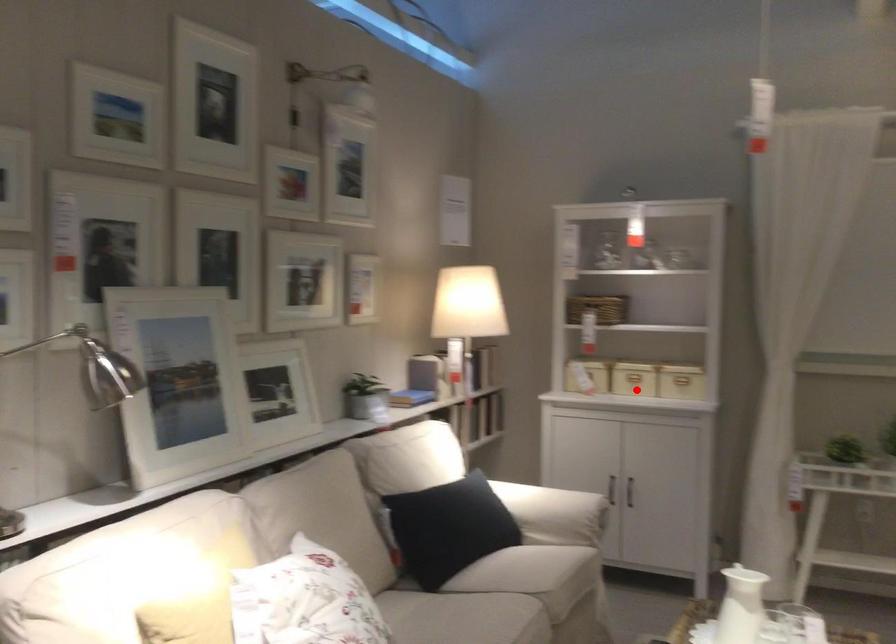
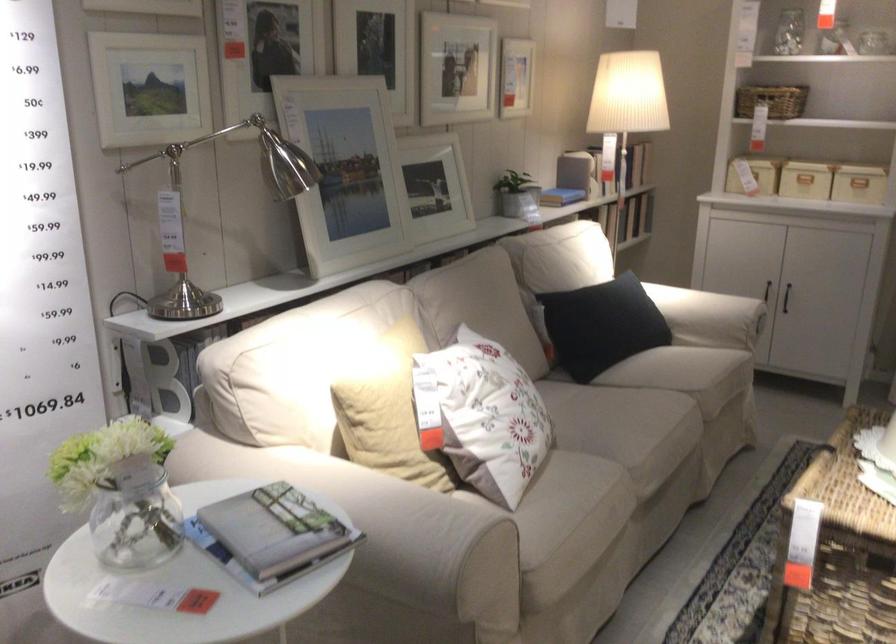
Where in the second image is the point corresponding to the highlighted location from the first image?

(805, 180)